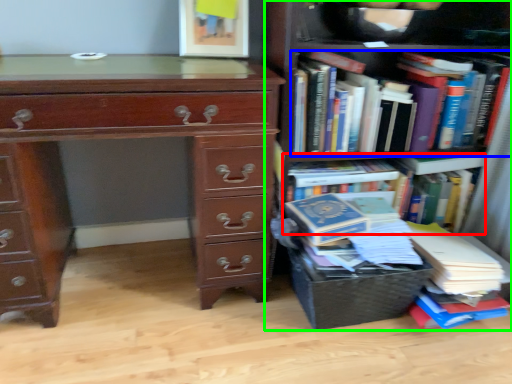
Question: Based on their relative distances, which object is nearer to book (highlighted by a red box)? Choose from book (highlighted by a blue box) and bookcase (highlighted by a green box).

Choices:
 (A) book
 (B) bookcase

Answer: (A)